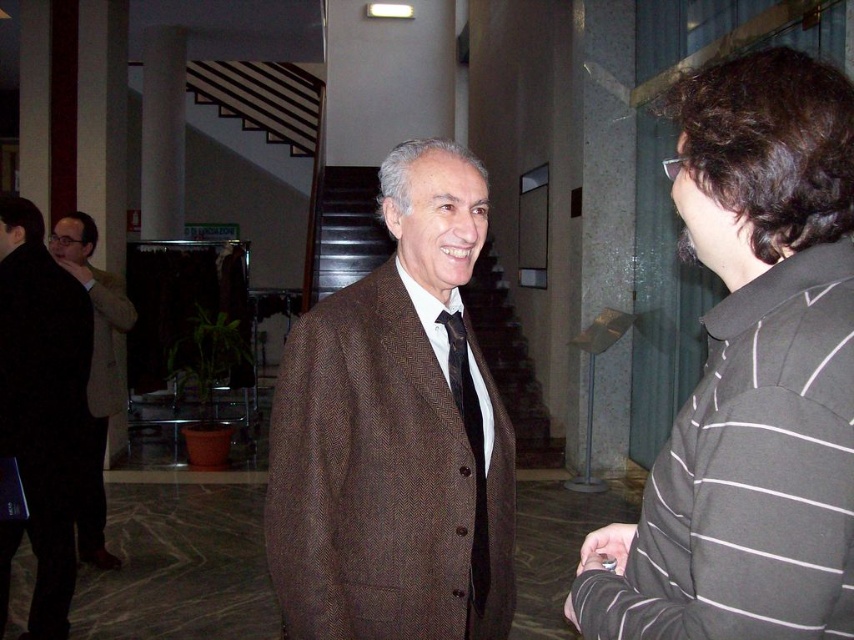
You are a tailor measuring the distance between the brown woolen suit at center and the black silk tie at center for a fitting. The minimum required distance for proper measurement is 12 centimeters. Is the current distance sufficient?

The brown woolen suit at center and black silk tie at center are 11.92 centimeters apart from each other, which is slightly less than the required 12 centimeters. The current distance is not sufficient for proper measurement.

You are standing in the lobby and need to determine the relative positions of two points marked in the image. Which of the two points, point 1 at coordinates (354, 509) or point 2 at (488, 580), is closer to your current position?

Point 1 at coordinates (354, 509) is closer to the camera than point 2 at (488, 580), so it is closer to your current position.